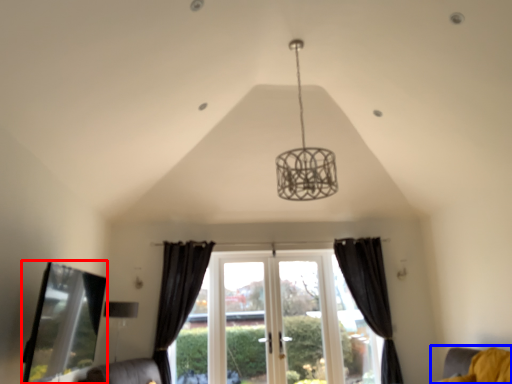
Question: Among these objects, which one is nearest to the camera, bay window (highlighted by a red box) or furniture (highlighted by a blue box)?

Choices:
 (A) bay window
 (B) furniture

Answer: (A)